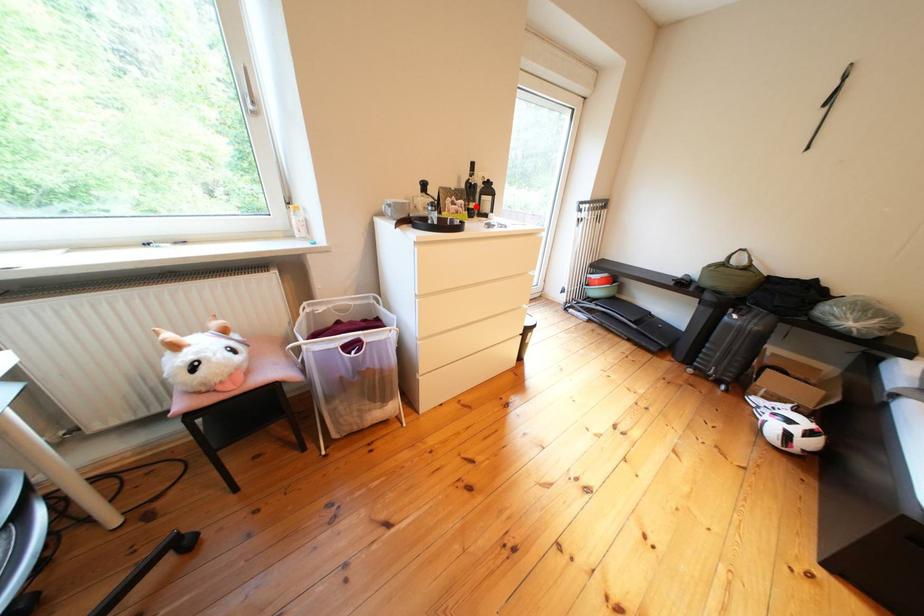
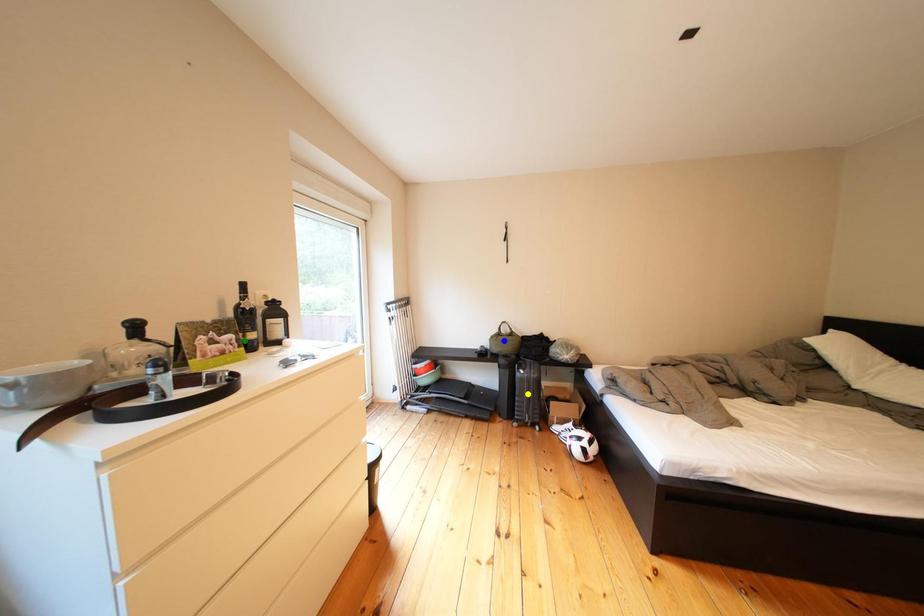
Question: I am providing you with two images of the same scene from different viewpoints. A red point is marked on the first image. You are given multiple points on the second image. Can you choose the point in image 2 that corresponds to the point in image 1?

Choices:
 (A) blue point
 (B) yellow point
 (C) green point

Answer: (C)